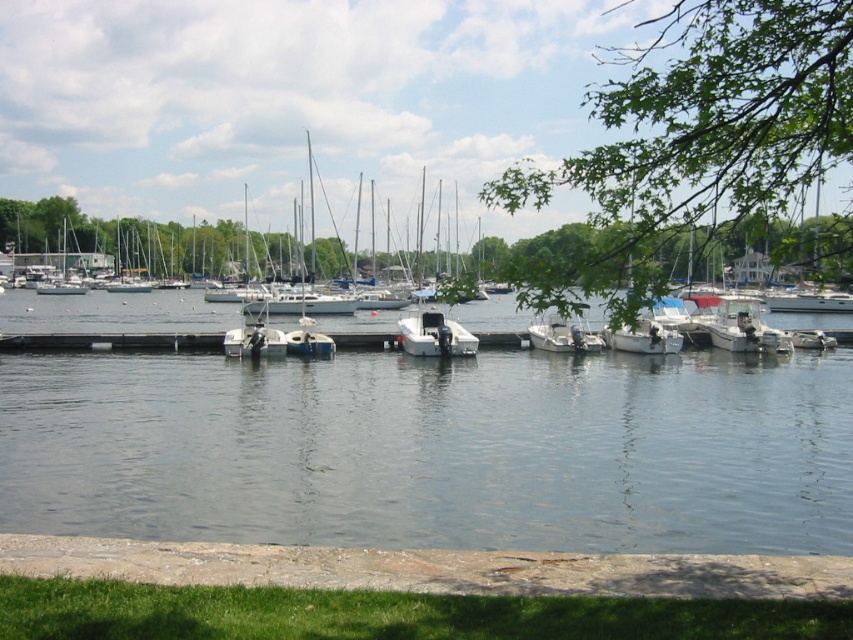
Does transparent water at center appear on the left side of white matte boat at center?

Correct, you'll find transparent water at center to the left of white matte boat at center.

Who is shorter, transparent water at center or white matte boat at center?

white matte boat at center

Is point (224, 499) in front of point (468, 333)?

Yes, it is.

Where is `transparent water at center`? transparent water at center is located at coordinates (434, 449).

Between point (740, 77) and point (433, 346), which one is positioned in front?

Point (740, 77) is more forward.

Which is in front, point (614, 296) or point (426, 332)?

Point (614, 296) is in front.

The height and width of the screenshot is (640, 853). I want to click on green leafy tree at upper right, so click(x=694, y=141).

Looking at this image, does transparent water at center have a lesser height compared to green leafy tree at upper right?

Indeed, transparent water at center has a lesser height compared to green leafy tree at upper right.

Is transparent water at center wider than green leafy tree at upper right?

In fact, transparent water at center might be narrower than green leafy tree at upper right.

Is point (177, 508) positioned in front of point (589, 109)?

Yes, it is in front of point (589, 109).

I want to click on transparent water at center, so click(x=434, y=449).